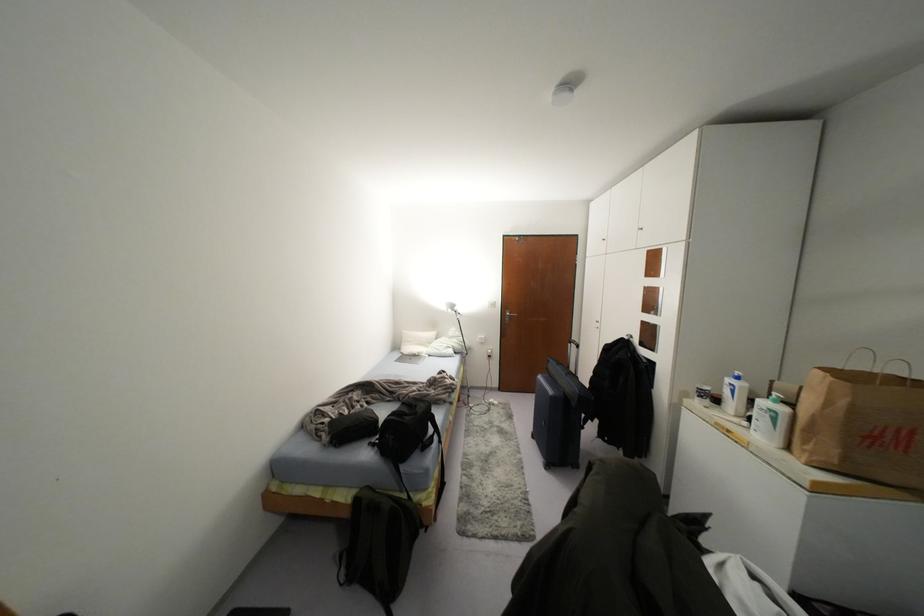
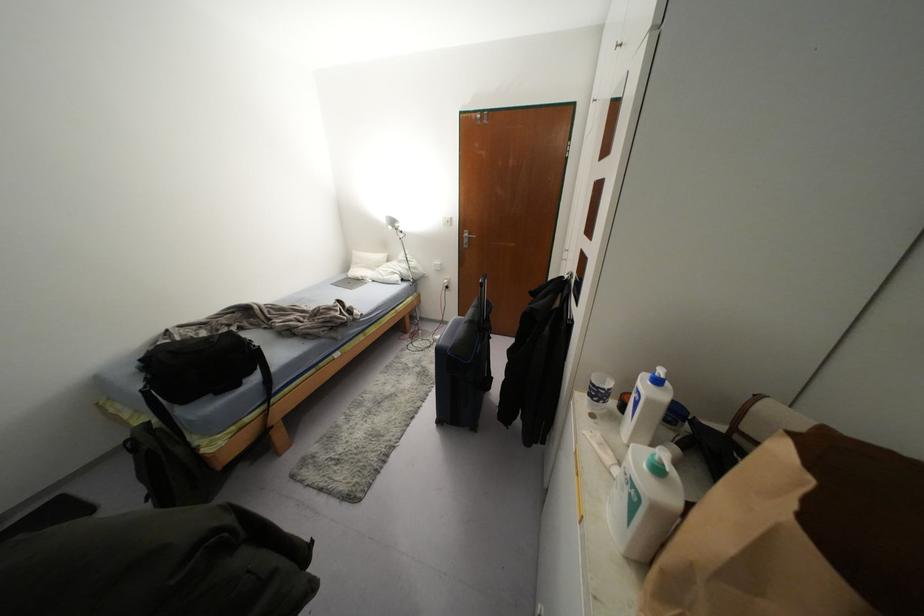
The point at (431, 334) is marked in the first image. Where is the corresponding point in the second image?

(382, 256)